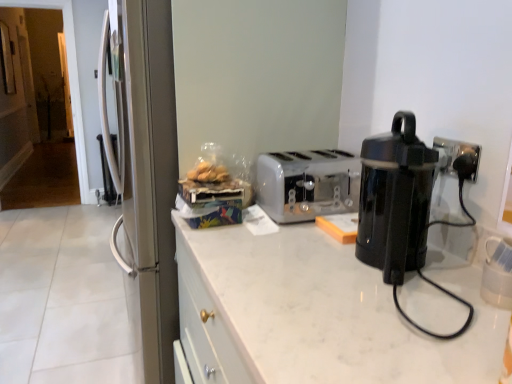
Question: Is white plastic toaster at center far away from black plastic coffee pot at right?

Choices:
 (A) no
 (B) yes

Answer: (A)

Question: Is white plastic toaster at center shorter than black plastic coffee pot at right?

Choices:
 (A) no
 (B) yes

Answer: (B)

Question: From the image's perspective, is white plastic toaster at center beneath black plastic coffee pot at right?

Choices:
 (A) no
 (B) yes

Answer: (A)

Question: Is white plastic toaster at center positioned behind black plastic coffee pot at right?

Choices:
 (A) no
 (B) yes

Answer: (B)

Question: Is white plastic toaster at center oriented away from black plastic coffee pot at right?

Choices:
 (A) no
 (B) yes

Answer: (A)

Question: Is point (364, 251) positioned closer to the camera than point (300, 180)?

Choices:
 (A) farther
 (B) closer

Answer: (B)

Question: Considering the relative positions of black plastic coffee pot at right and white plastic toaster at center in the image provided, is black plastic coffee pot at right to the left or to the right of white plastic toaster at center?

Choices:
 (A) left
 (B) right

Answer: (B)

Question: Which is correct: black plastic coffee pot at right is inside white plastic toaster at center, or outside of it?

Choices:
 (A) outside
 (B) inside

Answer: (A)

Question: From their relative heights in the image, would you say black plastic coffee pot at right is taller or shorter than white plastic toaster at center?

Choices:
 (A) tall
 (B) short

Answer: (A)

Question: From the image's perspective, is white plastic toaster at center positioned above or below white marble countertop at center?

Choices:
 (A) below
 (B) above

Answer: (B)

Question: From a real-world perspective, is white plastic toaster at center positioned above or below white marble countertop at center?

Choices:
 (A) above
 (B) below

Answer: (A)

Question: Looking at the image, does white plastic toaster at center seem bigger or smaller compared to white marble countertop at center?

Choices:
 (A) big
 (B) small

Answer: (B)

Question: Relative to white marble countertop at center, is white plastic toaster at center in front or behind?

Choices:
 (A) behind
 (B) front

Answer: (A)

Question: From a real-world perspective, relative to white marble countertop at center, is black plastic coffee pot at right vertically above or below?

Choices:
 (A) above
 (B) below

Answer: (A)

Question: In terms of size, does black plastic coffee pot at right appear bigger or smaller than white marble countertop at center?

Choices:
 (A) big
 (B) small

Answer: (B)